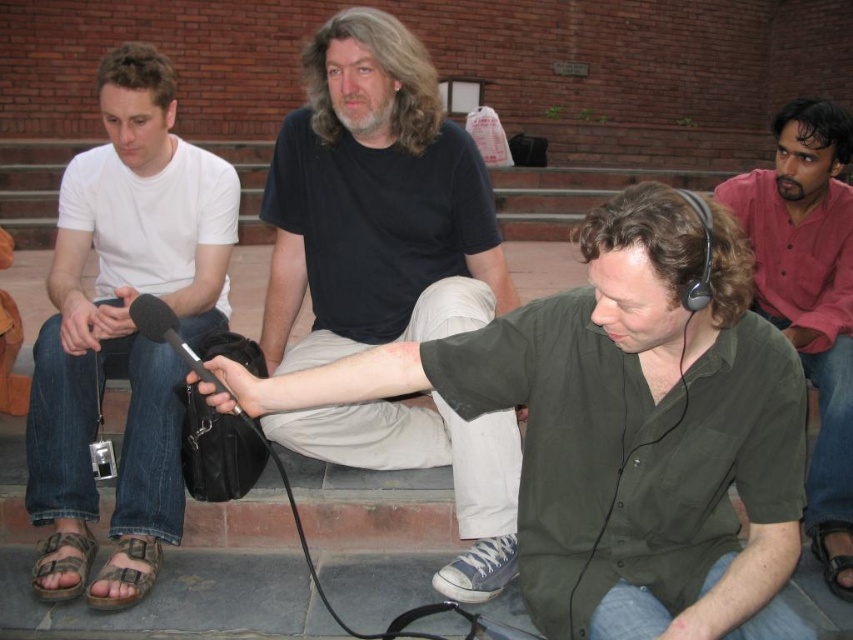
You are a photographer standing in front of the scene. You want to take a picture of the green matte shirt at center and the brown canvas sandal at lower left. Which object will appear larger in the photo?

The green matte shirt at center will appear larger in the photo because it is closer to the viewer than the brown canvas sandal at lower left.

You are a photographer trying to capture a candid shot of the black matte shirt at center and the brown leather sandal at lower right. Since you want to ensure both are in focus, which one should you focus on first to maintain depth of field?

The black matte shirt at center is in front of the brown leather sandal at lower right, so you should focus on the black matte shirt at center first to ensure both are in focus.

You are a photographer standing in front of the scene. You want to take a photo of the black matte shirt at center and the brown leather sandal at lower right. Which object should you focus on first if you want to capture both in sharp focus?

The black matte shirt at center is to the left of brown leather sandal at lower right. Since they are positioned side by side, you can focus on either one as they are at the same distance from the camera.